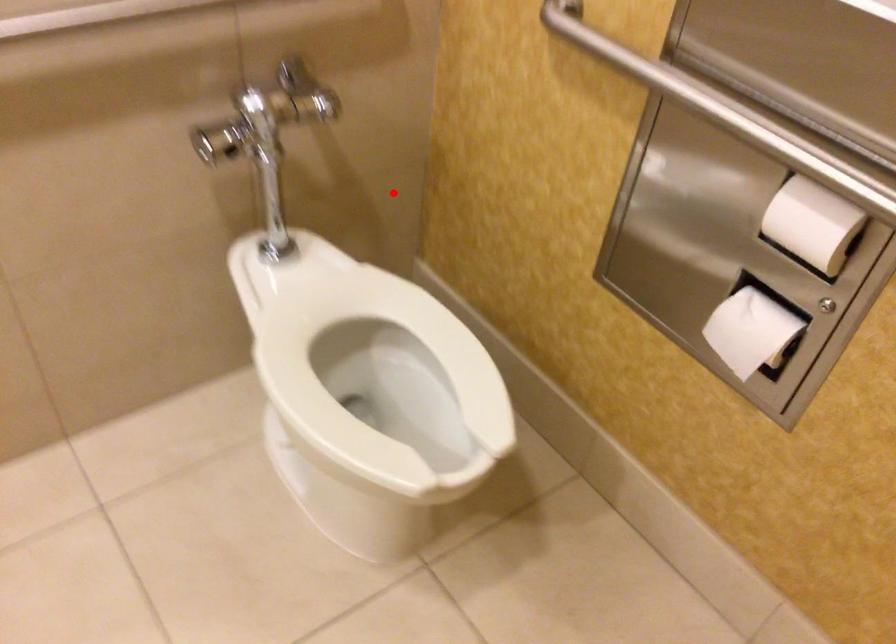
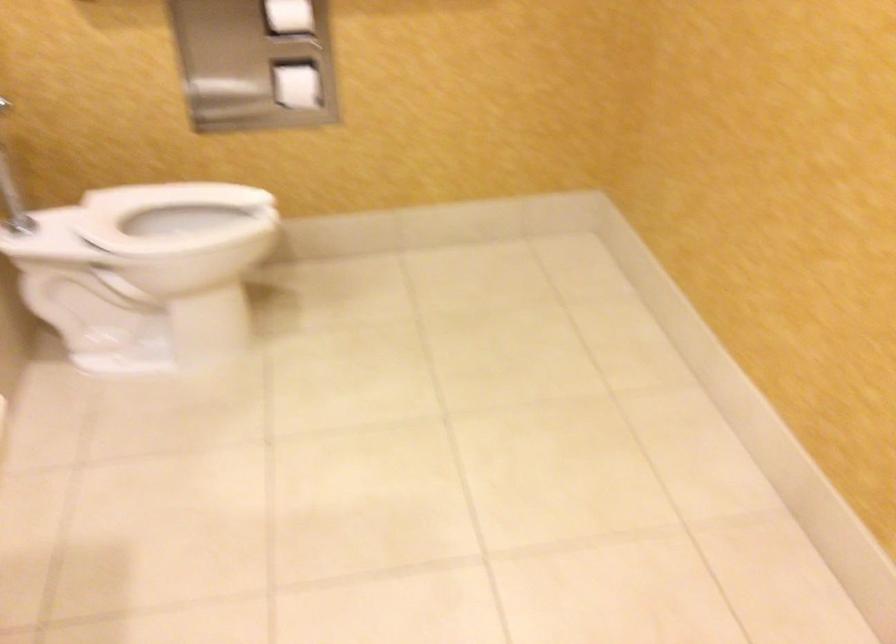
Where in the second image is the point corresponding to the highlighted location from the first image?

(12, 191)